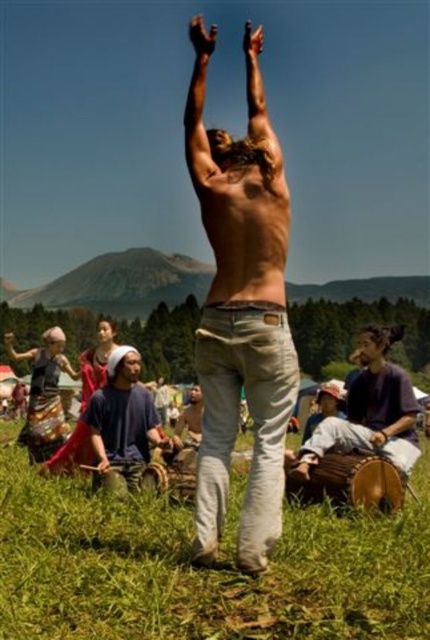
Does brown leather drum at lower center have a lesser height compared to brown leather drum at center?

Incorrect, brown leather drum at lower center's height does not fall short of brown leather drum at center's.

Image resolution: width=430 pixels, height=640 pixels. What do you see at coordinates (378, 436) in the screenshot?
I see `brown leather drum at lower center` at bounding box center [378, 436].

Find the location of `brown leather drum at lower center`. brown leather drum at lower center is located at coordinates (378, 436).

Can you confirm if green grass at center is taller than brown leather hand at upper center?

No, green grass at center is not taller than brown leather hand at upper center.

Can you confirm if green grass at center is shorter than brown leather hand at upper center?

Correct, green grass at center is not as tall as brown leather hand at upper center.

You are a GUI agent. You are given a task and a screenshot of the screen. Output one action in this format:
    pyautogui.click(x=<x>, y=<y>)
    Task: Click on the green grass at center
    Image resolution: width=430 pixels, height=640 pixels.
    Given the screenshot: What is the action you would take?
    pyautogui.click(x=199, y=570)

Find the location of a particular element. This screenshot has height=640, width=430. green grass at center is located at coordinates (199, 570).

How far apart are light brown denim jeans at center and dark blue t-shirt at lower right?

A distance of 3.01 meters exists between light brown denim jeans at center and dark blue t-shirt at lower right.

Is point (224, 221) closer to camera compared to point (417, 444)?

Yes, it is.

Locate an element on the screen. light brown denim jeans at center is located at coordinates point(242,317).

Where is `light brown denim jeans at center`? The width and height of the screenshot is (430, 640). light brown denim jeans at center is located at coordinates (242, 317).